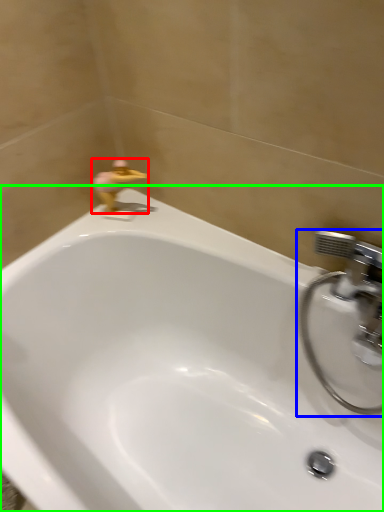
Question: Considering the real-world distances, which object is closest to plumbing fixture (highlighted by a red box)? tap (highlighted by a blue box) or bathtub (highlighted by a green box).

Choices:
 (A) tap
 (B) bathtub

Answer: (B)